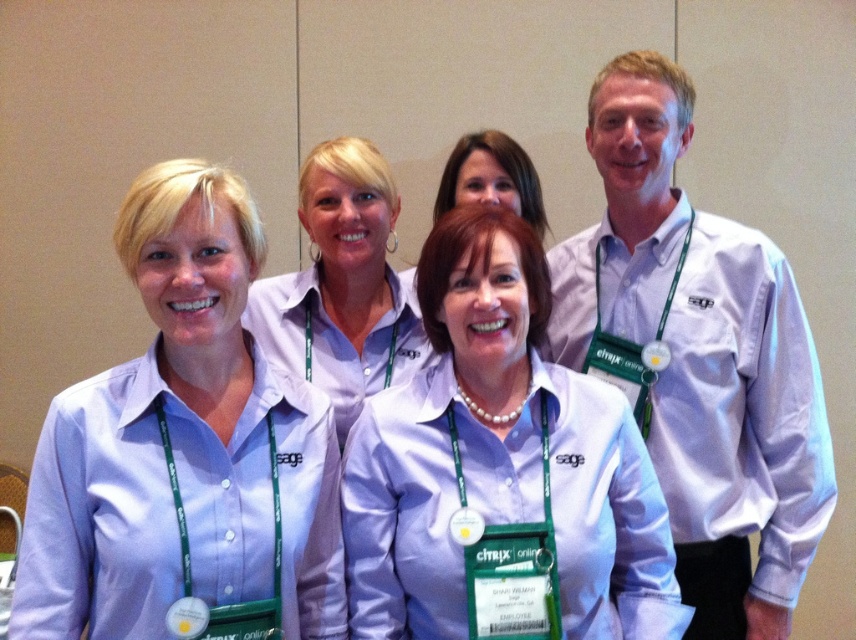
You are organizing a photo shoot and need to ensure that the matte purple shirt at left and the white shirt at right are both visible in the frame. Based on their size in the image, which shirt might require you to adjust the camera angle to ensure it is fully captured?

The white shirt at right occupies more space in the image than the matte purple shirt at left, so the white shirt at right might require adjusting the camera angle to ensure it is fully captured.

You are standing in front of the group of five individuals at the professional event. You need to hand out a document to the person wearing the white shirt at right and the matte white shirt at center. Which person is located to the right of the other?

The white shirt at right is positioned on the right side of matte white shirt at center, so the white shirt at right is to the right of the matte white shirt at center.

You are a photographer standing at the camera position. You need to adjust your focus to capture the matte white shirt at center clearly. What is the approximate distance you should set your camera focus to?

The distance between the matte white shirt at center and the camera is approximately 4.98 feet, so you should set your camera focus to around 5 feet to capture it clearly.